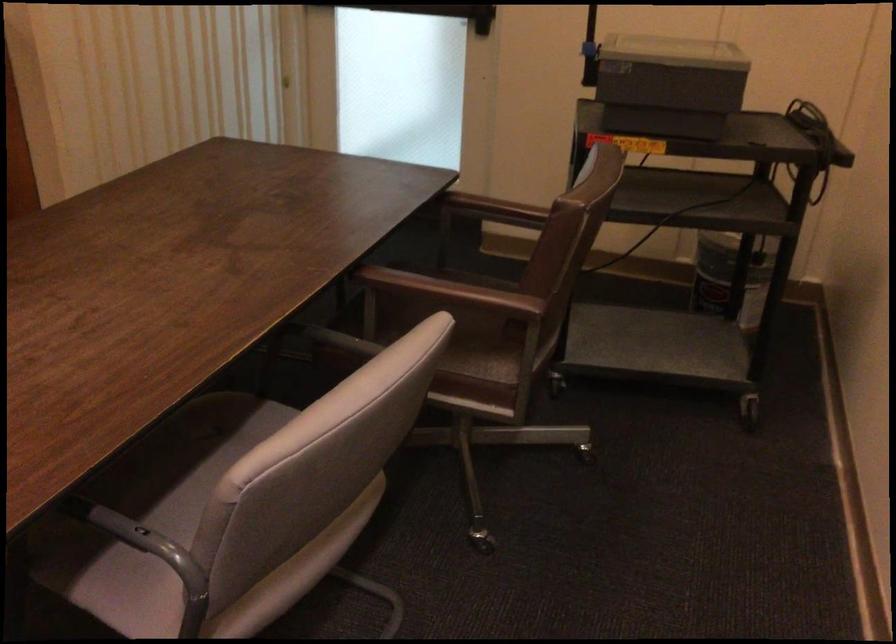
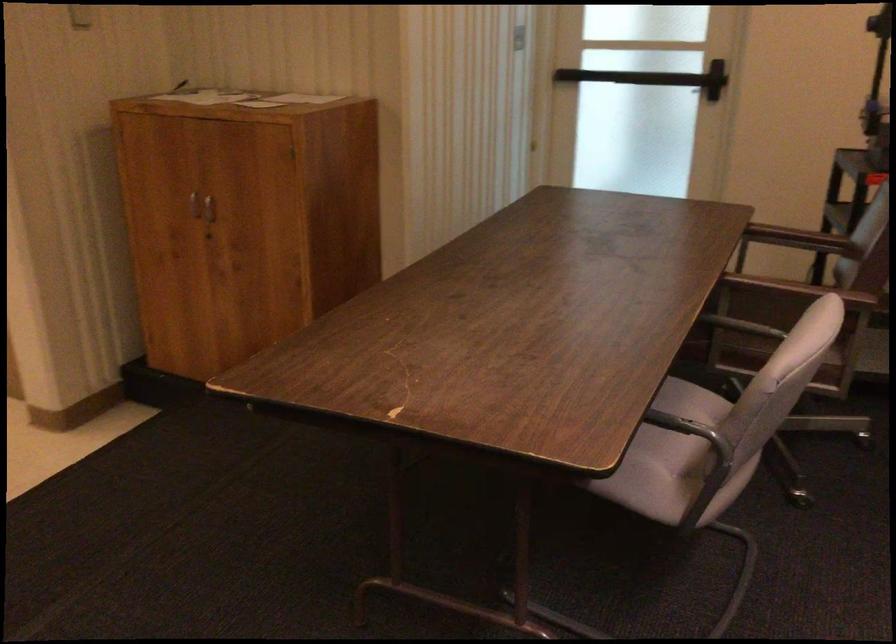
Question: How did the camera likely rotate?

Choices:
 (A) Left
 (B) Right
 (C) Up
 (D) Down

Answer: (A)